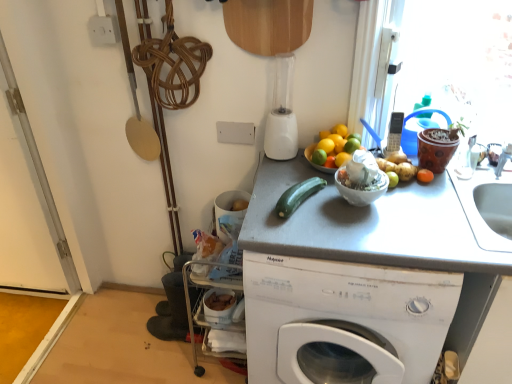
Locate an element on the screen. The width and height of the screenshot is (512, 384). free area in between white glossy bowl at center and orange matte at right is located at coordinates (403, 196).